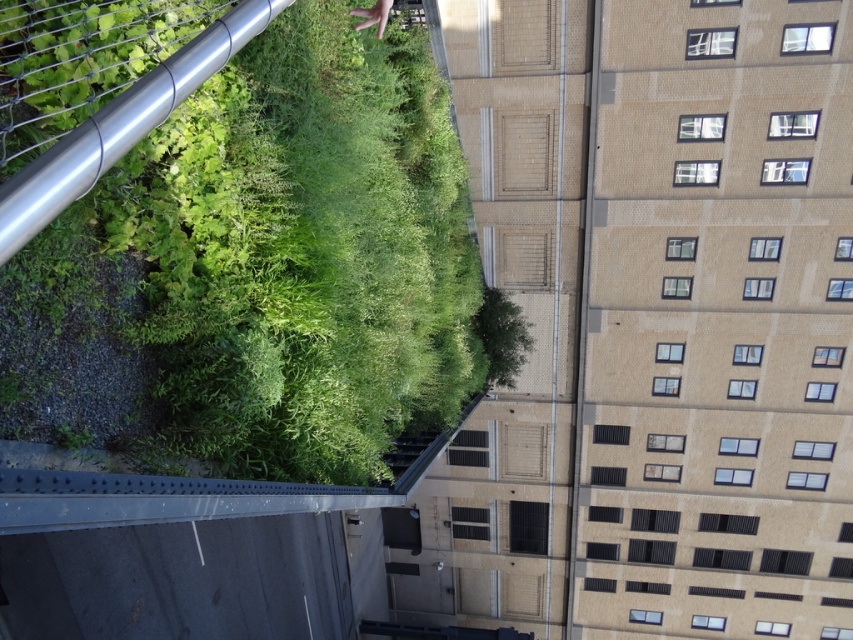
Is point (316, 365) closer to camera compared to point (363, 22)?

No.

Who is more distant from viewer, (265, 196) or (380, 3)?

Point (380, 3)

Is point (289, 330) closer to viewer compared to point (364, 8)?

Yes, it is in front of point (364, 8).

I want to click on green leafy plant at upper left, so pyautogui.click(x=303, y=253).